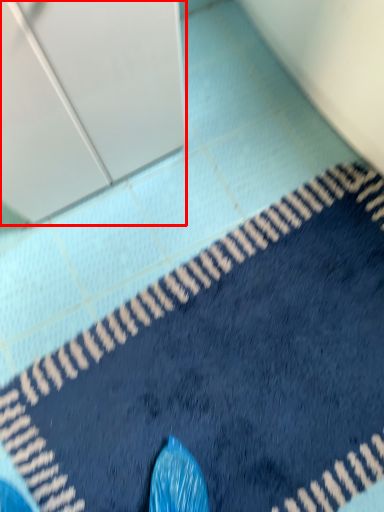
Question: From the image's perspective, where is screen door (annotated by the red box) located in relation to bath mat in the image?

Choices:
 (A) below
 (B) above

Answer: (B)